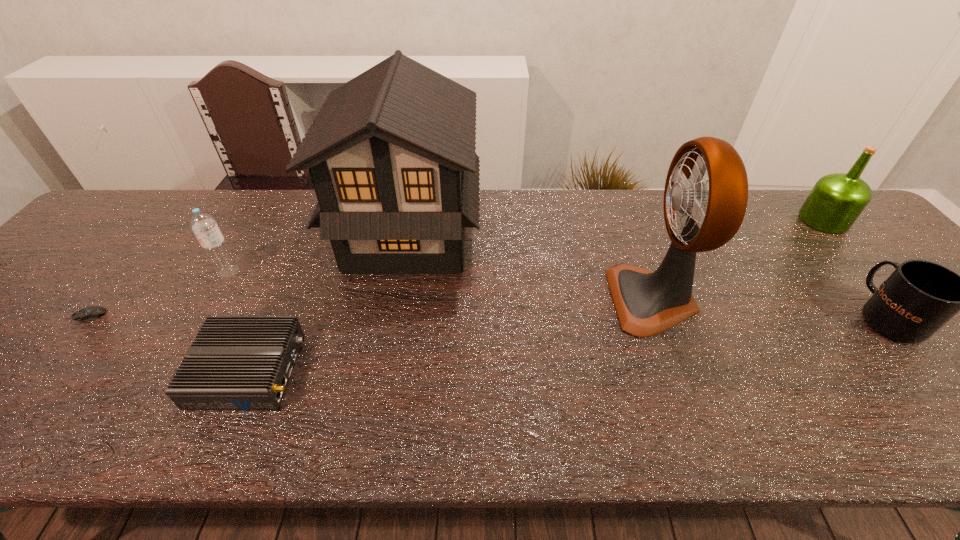
Identify the location of dollhouse that is at the far edge. This screenshot has width=960, height=540. (391, 154).

Image resolution: width=960 pixels, height=540 pixels. I want to click on olive oil positioned at the far edge, so click(x=835, y=202).

Locate an element on the screen. object that is at the near edge is located at coordinates (235, 362).

You are a GUI agent. You are given a task and a screenshot of the screen. Output one action in this format:
    pyautogui.click(x=<x>, y=<y>)
    Task: Click on the object at the left edge
    
    Given the screenshot: What is the action you would take?
    pyautogui.click(x=89, y=313)

Find the location of `olive oil present at the right edge`. olive oil present at the right edge is located at coordinates (835, 202).

The width and height of the screenshot is (960, 540). Identify the location of mug that is at the right edge. (919, 297).

The width and height of the screenshot is (960, 540). What are the coordinates of `object situated at the far right corner` in the screenshot? It's located at (835, 202).

Image resolution: width=960 pixels, height=540 pixels. Identify the location of vacant space at the far edge of the desktop. (509, 224).

In the image, there is a desktop. Where is `vacant region at the near edge`? This screenshot has width=960, height=540. vacant region at the near edge is located at coordinates (255, 426).

Find the location of `vacant space at the far left corner`. vacant space at the far left corner is located at coordinates (99, 232).